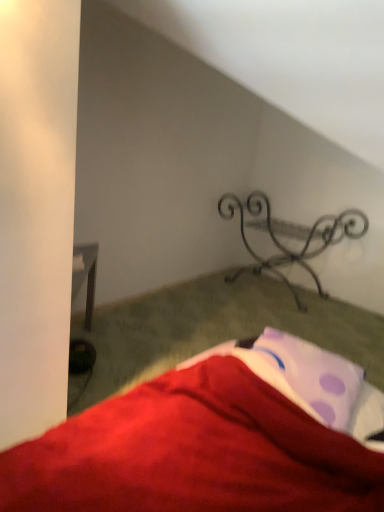
Question: Is metallic wrought iron bench at center bigger or smaller than purple dotted fabric at lower right?

Choices:
 (A) big
 (B) small

Answer: (A)

Question: In terms of width, does metallic wrought iron bench at center look wider or thinner when compared to purple dotted fabric at lower right?

Choices:
 (A) wide
 (B) thin

Answer: (A)

Question: From the image's perspective, is metallic wrought iron bench at center located above or below purple dotted fabric at lower right?

Choices:
 (A) above
 (B) below

Answer: (A)

Question: In terms of size, does purple dotted fabric at lower right appear bigger or smaller than metallic wrought iron bench at center?

Choices:
 (A) big
 (B) small

Answer: (B)

Question: Considering the positions of point (276, 373) and point (296, 294), is point (276, 373) closer or farther from the camera than point (296, 294)?

Choices:
 (A) farther
 (B) closer

Answer: (B)

Question: Do you think purple dotted fabric at lower right is within metallic wrought iron bench at center, or outside of it?

Choices:
 (A) inside
 (B) outside

Answer: (B)

Question: From a real-world perspective, is purple dotted fabric at lower right physically located above or below metallic wrought iron bench at center?

Choices:
 (A) above
 (B) below

Answer: (A)